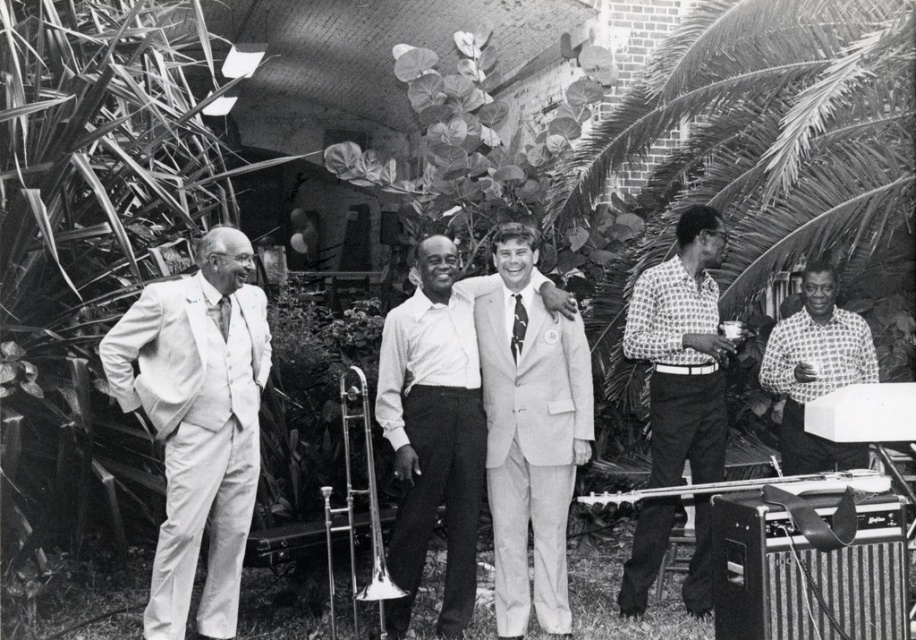
Question: Is light gray suit at center thinner than printed cotton shirt at right?

Choices:
 (A) yes
 (B) no

Answer: (B)

Question: Can you confirm if light gray suit at left is bigger than patterned silk tie at center?

Choices:
 (A) yes
 (B) no

Answer: (A)

Question: Can you confirm if light gray suit at center is bigger than printed cotton shirt at right?

Choices:
 (A) yes
 (B) no

Answer: (A)

Question: Which of the following is the closest to the observer?

Choices:
 (A) (219, 301)
 (B) (389, 317)

Answer: (A)

Question: Estimate the real-world distances between objects in this image. Which object is farther from the checkered shirt at center?

Choices:
 (A) printed cotton shirt at right
 (B) light gray wool suit at center
 (C) matte black tie at left

Answer: (C)

Question: Which object is the closest to the printed cotton shirt at right?

Choices:
 (A) light gray suit at left
 (B) patterned silk tie at center
 (C) light gray wool suit at center
 (D) checkered shirt at center

Answer: (C)